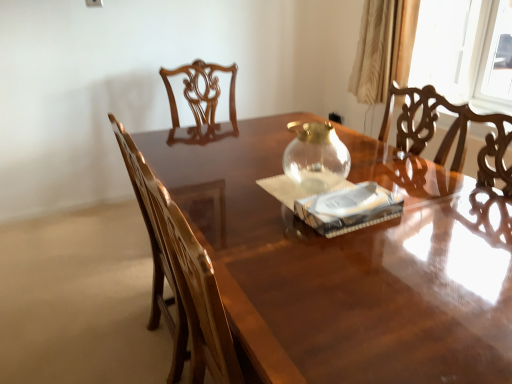
Question: From the image's perspective, does white paper at center appear lower than transparent glass teapot at center?

Choices:
 (A) no
 (B) yes

Answer: (B)

Question: Are white paper at center and transparent glass teapot at center located far from each other?

Choices:
 (A) yes
 (B) no

Answer: (B)

Question: Does white paper at center have a greater height compared to transparent glass teapot at center?

Choices:
 (A) no
 (B) yes

Answer: (A)

Question: Is white paper at center facing away from transparent glass teapot at center?

Choices:
 (A) yes
 (B) no

Answer: (B)

Question: Considering the relative sizes of white paper at center and transparent glass teapot at center in the image provided, is white paper at center wider than transparent glass teapot at center?

Choices:
 (A) no
 (B) yes

Answer: (B)

Question: Is white paper at center outside of transparent glass teapot at center?

Choices:
 (A) yes
 (B) no

Answer: (A)

Question: Is glossy wood chair at left located within white paper at center?

Choices:
 (A) yes
 (B) no

Answer: (B)

Question: Can you confirm if white paper at center is thinner than glossy wood chair at left?

Choices:
 (A) no
 (B) yes

Answer: (B)

Question: Are white paper at center and glossy wood chair at left making contact?

Choices:
 (A) yes
 (B) no

Answer: (B)

Question: Is white paper at center shorter than glossy wood chair at left?

Choices:
 (A) no
 (B) yes

Answer: (B)

Question: Considering the relative positions of white paper at center and glossy wood chair at left in the image provided, is white paper at center to the left of glossy wood chair at left from the viewer's perspective?

Choices:
 (A) yes
 (B) no

Answer: (B)

Question: Does white paper at center come in front of glossy wood chair at left?

Choices:
 (A) yes
 (B) no

Answer: (B)

Question: Is transparent glass teapot at center further to the viewer compared to beige satin curtain at upper right?

Choices:
 (A) yes
 (B) no

Answer: (B)